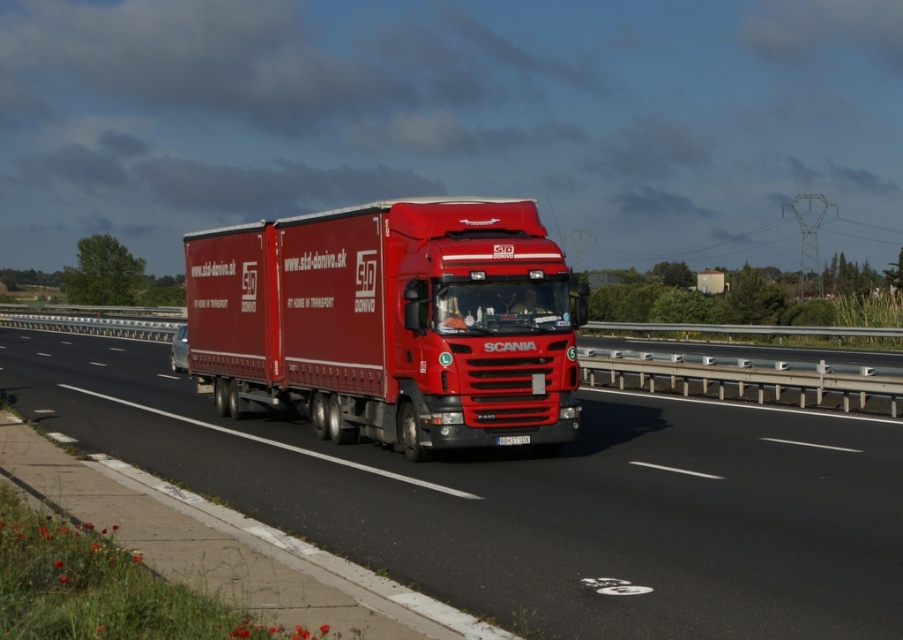
Can you confirm if matte red truck at center is thinner than matte red trailer truck at center?

No.

Between matte red truck at center and matte red trailer truck at center, which one appears on the right side from the viewer's perspective?

matte red trailer truck at center

I want to click on matte red truck at center, so click(x=534, y=500).

Image resolution: width=903 pixels, height=640 pixels. What are the coordinates of `matte red truck at center` in the screenshot? It's located at (534, 500).

Is matte red trailer truck at center closer to camera compared to white plastic license plate at center?

Yes.

Describe the element at coordinates (389, 323) in the screenshot. The height and width of the screenshot is (640, 903). I see `matte red trailer truck at center` at that location.

Where is `matte red trailer truck at center`? The width and height of the screenshot is (903, 640). matte red trailer truck at center is located at coordinates (389, 323).

At what (x,y) coordinates should I click in order to perform the action: click on matte red trailer truck at center. Please return your answer as a coordinate pair (x, y). This screenshot has height=640, width=903. Looking at the image, I should click on (389, 323).

Is matte red truck at center taller than white plastic license plate at center?

Correct, matte red truck at center is much taller as white plastic license plate at center.

Can you confirm if matte red truck at center is positioned to the left of white plastic license plate at center?

Correct, you'll find matte red truck at center to the left of white plastic license plate at center.

Which is in front, point (435, 456) or point (508, 438)?

Point (508, 438)

This screenshot has width=903, height=640. Find the location of `matte red truck at center`. matte red truck at center is located at coordinates (534, 500).